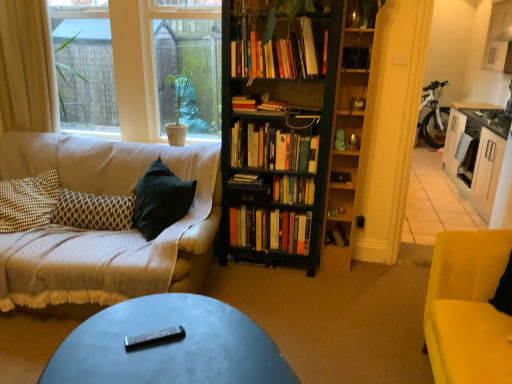
Question: Choose the correct answer: Is black wooden bookcase at center inside white fabric curtain at left or outside it?

Choices:
 (A) outside
 (B) inside

Answer: (A)

Question: Is black wooden bookcase at center taller or shorter than white fabric curtain at left?

Choices:
 (A) tall
 (B) short

Answer: (A)

Question: Estimate the real-world distances between objects in this image. Which object is farther from the black wooden bookcase at center?

Choices:
 (A) patterned fabric pillow at left
 (B) clear glass window screen at upper left
 (C) green matte plant at upper center
 (D) wooden cabinet at right
 (E) white fabric curtain at left

Answer: (D)

Question: Estimate the real-world distances between objects in this image. Which object is farther from the hardcover books at center, acting as the seventh book starting from the top?

Choices:
 (A) wooden shelf at right
 (B) black wooden bookcase at center
 (C) clear glass window screen at upper left
 (D) hardcover books at center, the 8th book ordered from the bottom
 (E) patterned fabric pillow at left

Answer: (C)